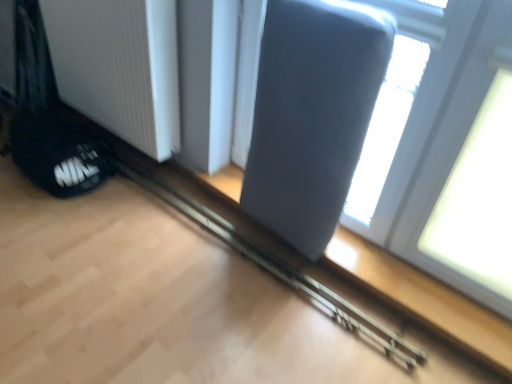
Locate an element on the screen. The width and height of the screenshot is (512, 384). blank area to the left of metallic gray rail at center is located at coordinates (116, 235).